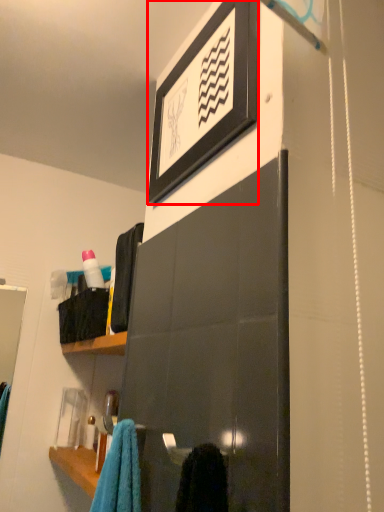
Question: From the image, what is the correct spatial relationship of picture frame (annotated by the red box) in relation to bottle?

Choices:
 (A) right
 (B) left

Answer: (A)